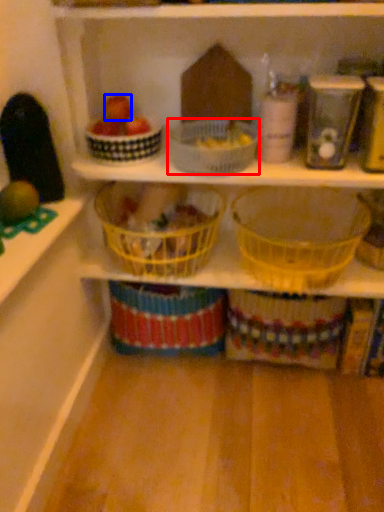
Question: Which of the following is the closest to the observer, basket (highlighted by a red box) or apple (highlighted by a blue box)?

Choices:
 (A) basket
 (B) apple

Answer: (A)